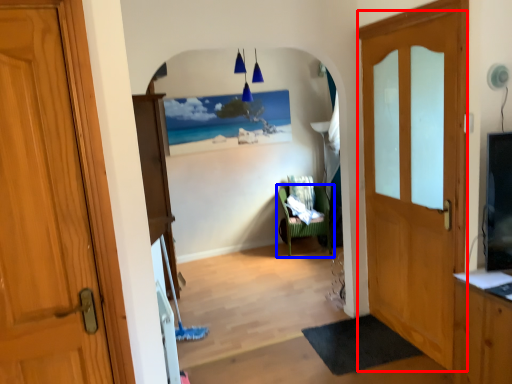
Question: Which of the following is the farthest to the observer, door (highlighted by a red box) or chair (highlighted by a blue box)?

Choices:
 (A) door
 (B) chair

Answer: (B)